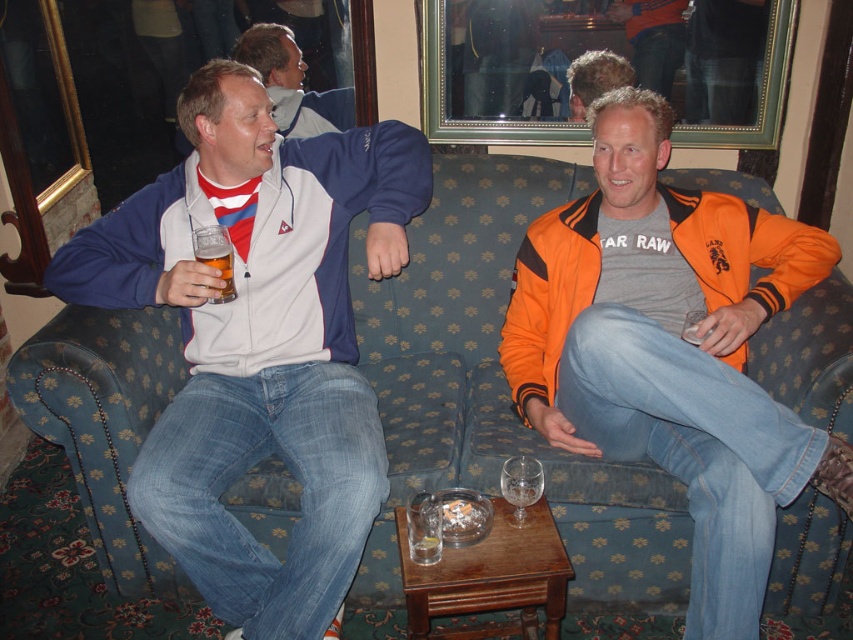
Question: Does blue fabric couch at center appear on the left side of matte blue jacket at upper left?

Choices:
 (A) yes
 (B) no

Answer: (B)

Question: Among these points, which one is nearest to the camera?

Choices:
 (A) (257, 152)
 (B) (415, 561)
 (C) (599, 486)
 (D) (675, 204)

Answer: (B)

Question: Which point is closer to the camera?

Choices:
 (A) blue fabric couch at center
 (B) translucent glass at center

Answer: (B)

Question: Considering the relative positions of orange fabric jacket at center and matte blue jacket at upper left in the image provided, where is orange fabric jacket at center located with respect to matte blue jacket at upper left?

Choices:
 (A) left
 (B) right

Answer: (B)

Question: Is blue fabric couch at center thinner than matte blue jacket at upper left?

Choices:
 (A) no
 (B) yes

Answer: (A)

Question: Which is nearer to the matte blue jacket at left?

Choices:
 (A) translucent glass at center
 (B) orange fabric jacket at center

Answer: (B)